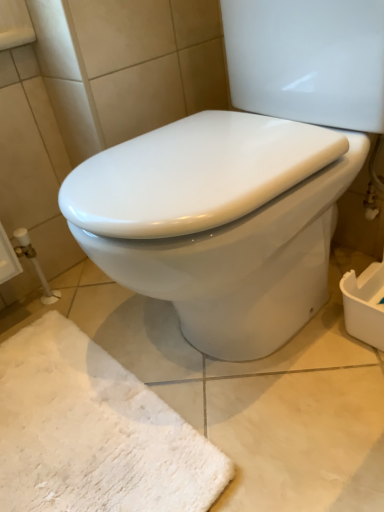
What do you see at coordinates (93, 432) in the screenshot?
I see `white fluffy bath mat at lower left` at bounding box center [93, 432].

Measure the distance between white fluffy bath mat at lower left and camera.

65.54 centimeters.

You are a GUI agent. You are given a task and a screenshot of the screen. Output one action in this format:
    pyautogui.click(x=<x>, y=<y>)
    Task: Click on the white fluffy bath mat at lower left
    This screenshot has height=512, width=384.
    Given the screenshot: What is the action you would take?
    pyautogui.click(x=93, y=432)

Where is `white fluffy bath mat at lower left`? Image resolution: width=384 pixels, height=512 pixels. white fluffy bath mat at lower left is located at coordinates (93, 432).